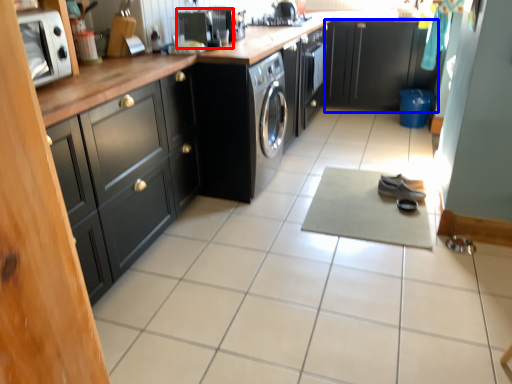
Question: Which of the following is the closest to the observer, appliance (highlighted by a red box) or cabinetry (highlighted by a blue box)?

Choices:
 (A) appliance
 (B) cabinetry

Answer: (A)